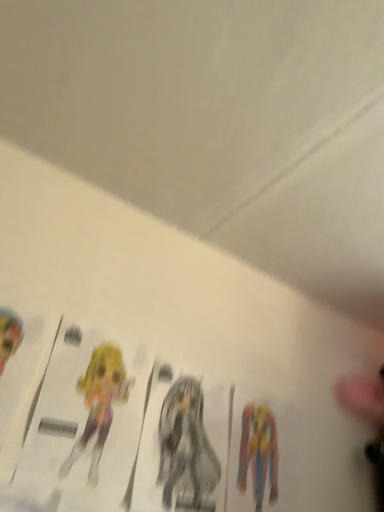
Describe the element at coordinates (186, 447) in the screenshot. I see `smooth black anime figure at center` at that location.

Image resolution: width=384 pixels, height=512 pixels. I want to click on smooth black anime figure at center, so click(186, 447).

Measure the distance between smooth black anime figure at center and camera.

smooth black anime figure at center is 31.63 inches from camera.

The image size is (384, 512). I want to click on smooth black anime figure at center, so click(x=186, y=447).